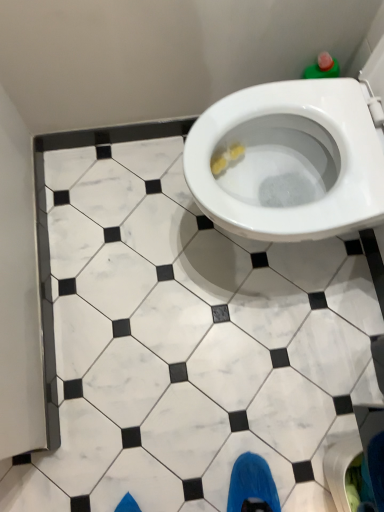
You are a GUI agent. You are given a task and a screenshot of the screen. Output one action in this format:
    pyautogui.click(x=<x>, y=<y>)
    Task: Click on the white glossy toilet at center
    The image size is (384, 512).
    Given the screenshot: What is the action you would take?
    pyautogui.click(x=290, y=161)

Describe the element at coordinates (290, 161) in the screenshot. I see `white glossy toilet at center` at that location.

Where is `white glossy toilet at center`? The image size is (384, 512). white glossy toilet at center is located at coordinates (290, 161).